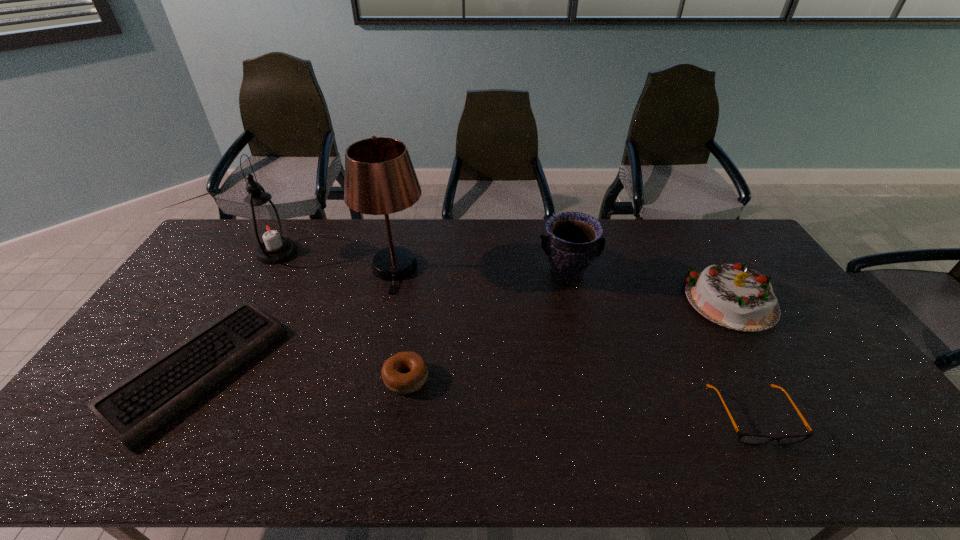
This screenshot has width=960, height=540. I want to click on free space between the cake and the bagel, so click(569, 340).

This screenshot has height=540, width=960. What are the coordinates of `vacant area that lies between the spectacles and the fifth shortest object` in the screenshot? It's located at (660, 346).

This screenshot has height=540, width=960. In order to click on empty location between the computer keyboard and the fourth tallest object in this screenshot , I will do `click(465, 336)`.

Find the location of a particular element. Image resolution: width=960 pixels, height=540 pixels. vacant area that lies between the bagel and the third tallest object is located at coordinates (487, 327).

Where is `empty space that is in between the computer keyboard and the bagel`? This screenshot has width=960, height=540. empty space that is in between the computer keyboard and the bagel is located at coordinates (302, 374).

What are the coordinates of `free area in between the spectacles and the fourth tallest object` in the screenshot? It's located at (743, 359).

In order to click on the fourth closest object to the computer keyboard in this screenshot , I will do `click(574, 241)`.

Identify which object is the third closest to the second tallest object. Please provide its 2D coordinates. Your answer should be formatted as a tuple, i.e. [(x, y)], where the tuple contains the x and y coordinates of a point satisfying the conditions above.

[(393, 371)]

Where is `vacant area in the image that satisfies the following two spatial constraints: 1. on the front-facing side of the cake; 2. on the left side of the tallest object`? This screenshot has width=960, height=540. vacant area in the image that satisfies the following two spatial constraints: 1. on the front-facing side of the cake; 2. on the left side of the tallest object is located at coordinates (386, 302).